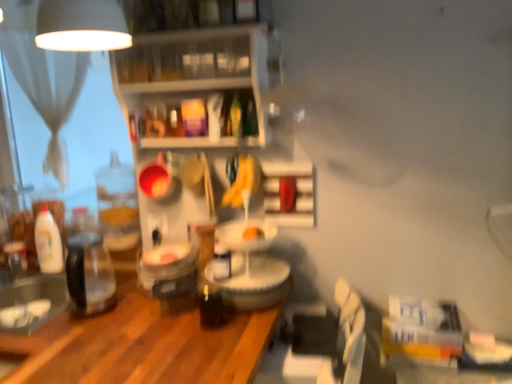
Question: From the image's perspective, is yellow matte bananas at center over clear plastic shelves at upper center, marked as the second shelf in a bottom-to-top arrangement?

Choices:
 (A) yes
 (B) no

Answer: (B)

Question: Is clear plastic shelves at upper center, which ranks as the 2th shelf in right-to-left order, located within yellow matte bananas at center?

Choices:
 (A) no
 (B) yes

Answer: (A)

Question: Does yellow matte bananas at center have a greater width compared to clear plastic shelves at upper center, the first shelf in the left-to-right sequence?

Choices:
 (A) yes
 (B) no

Answer: (B)

Question: Does yellow matte bananas at center have a larger size compared to clear plastic shelves at upper center, which ranks as the 2th shelf in right-to-left order?

Choices:
 (A) yes
 (B) no

Answer: (B)

Question: Is yellow matte bananas at center at the right side of clear plastic shelves at upper center, the first shelf in the left-to-right sequence?

Choices:
 (A) no
 (B) yes

Answer: (B)

Question: Is white matte shelf at center, the first shelf when ordered from right to left, situated inside white sheer curtain at upper left or outside?

Choices:
 (A) inside
 (B) outside

Answer: (B)

Question: Based on their sizes in the image, would you say white matte shelf at center, the first shelf when ordered from right to left, is bigger or smaller than white sheer curtain at upper left?

Choices:
 (A) small
 (B) big

Answer: (A)

Question: From a real-world perspective, is white matte shelf at center, the first shelf when ordered from right to left, above or below white sheer curtain at upper left?

Choices:
 (A) above
 (B) below

Answer: (B)

Question: From the image's perspective, is white matte shelf at center, which appears as the first shelf when ordered from the bottom, positioned above or below white sheer curtain at upper left?

Choices:
 (A) below
 (B) above

Answer: (A)

Question: Is point (280, 196) closer or farther from the camera than point (86, 248)?

Choices:
 (A) farther
 (B) closer

Answer: (B)

Question: From a real-world perspective, is white matte shelf at center, which appears as the first shelf when ordered from the bottom, above or below clear glass jar at left?

Choices:
 (A) below
 (B) above

Answer: (B)

Question: Is white matte shelf at center, which appears as the first shelf when ordered from the bottom, situated inside clear glass jar at left or outside?

Choices:
 (A) inside
 (B) outside

Answer: (B)

Question: From the image's perspective, is white matte shelf at center, the 2th shelf when ordered from top to bottom, positioned above or below clear glass jar at left?

Choices:
 (A) above
 (B) below

Answer: (A)

Question: Is point (288, 216) closer or farther from the camera than point (252, 94)?

Choices:
 (A) farther
 (B) closer

Answer: (A)

Question: In terms of height, does white matte shelf at center, the 2th shelf when ordered from top to bottom, look taller or shorter compared to clear plastic shelves at upper center, which ranks as the 2th shelf in right-to-left order?

Choices:
 (A) tall
 (B) short

Answer: (B)